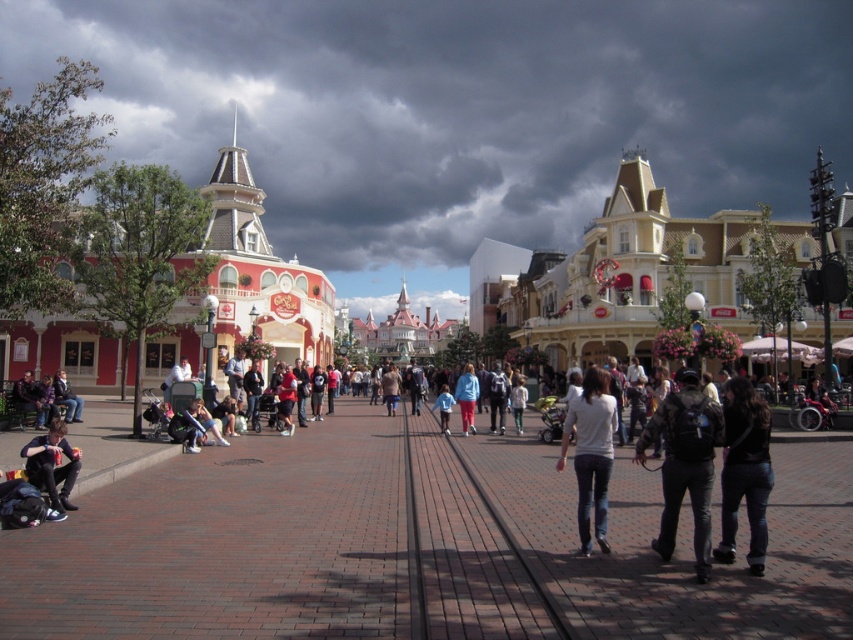
Question: Is white matte shirt at center in front of blue fabric shirt at center?

Choices:
 (A) yes
 (B) no

Answer: (A)

Question: Which point is farther from the camera taking this photo?

Choices:
 (A) (515, 376)
 (B) (746, 394)
 (C) (80, 417)

Answer: (A)

Question: Can you confirm if dark gray backpack at center is positioned to the left of blue fabric shirt at center?

Choices:
 (A) no
 (B) yes

Answer: (A)

Question: Does black leather jacket at center have a lesser width compared to matte black jacket at left?

Choices:
 (A) no
 (B) yes

Answer: (B)

Question: Which of the following is the closest to the observer?

Choices:
 (A) (67, 481)
 (B) (602, 371)

Answer: (B)

Question: Which point is farther to the camera?

Choices:
 (A) (477, 396)
 (B) (732, 413)

Answer: (A)